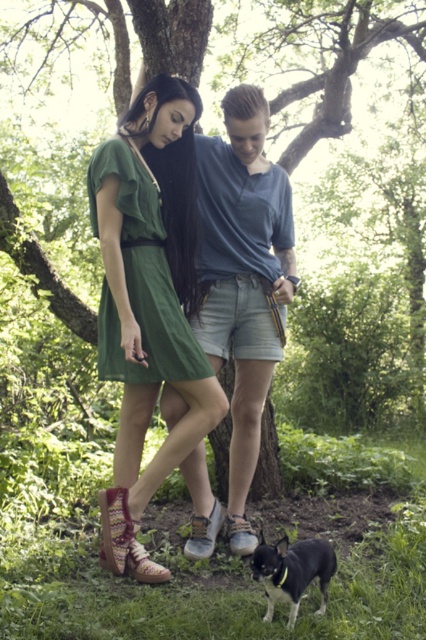
Question: Does green fabric dress at center come in front of blue cotton shirt at center?

Choices:
 (A) yes
 (B) no

Answer: (A)

Question: Which point is farther to the camera?

Choices:
 (A) (143, 216)
 (B) (273, 602)
 (C) (244, 372)

Answer: (C)

Question: Does green fabric dress at center have a larger size compared to black matte dog at lower center?

Choices:
 (A) no
 (B) yes

Answer: (B)

Question: Can you confirm if blue cotton shirt at center is wider than black matte dog at lower center?

Choices:
 (A) yes
 (B) no

Answer: (A)

Question: Among these objects, which one is farthest from the camera?

Choices:
 (A) green fabric dress at center
 (B) blue cotton shirt at center

Answer: (B)

Question: Which object appears farthest from the camera in this image?

Choices:
 (A) black matte dog at lower center
 (B) green fabric dress at center
 (C) blue cotton shirt at center

Answer: (C)